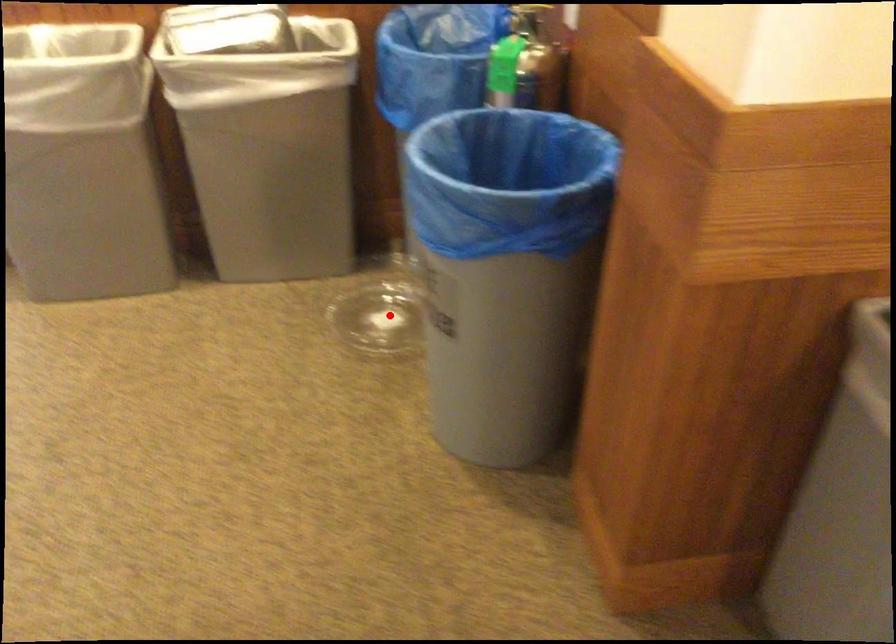
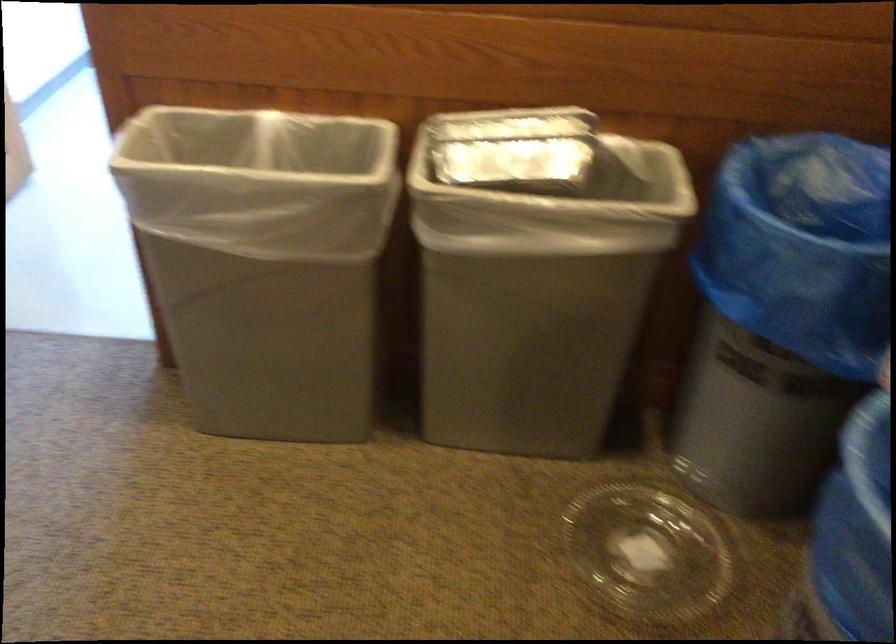
Question: A red point is marked in image1. In image2, is the corresponding 3D point closer to the camera or farther? Reply with the corresponding letter.

Choices:
 (A) The corresponding 3D point is closer.
 (B) The corresponding 3D point is farther.

Answer: (A)